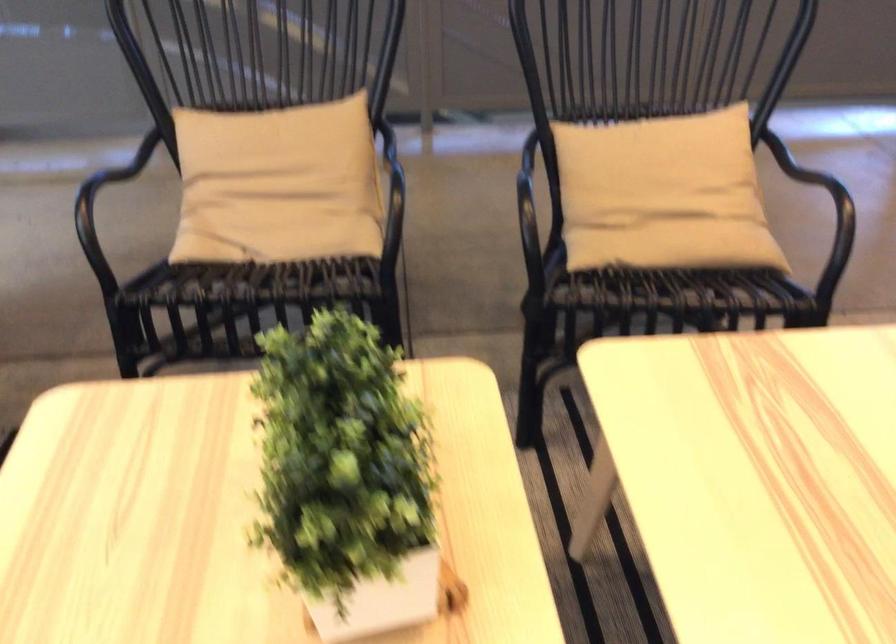
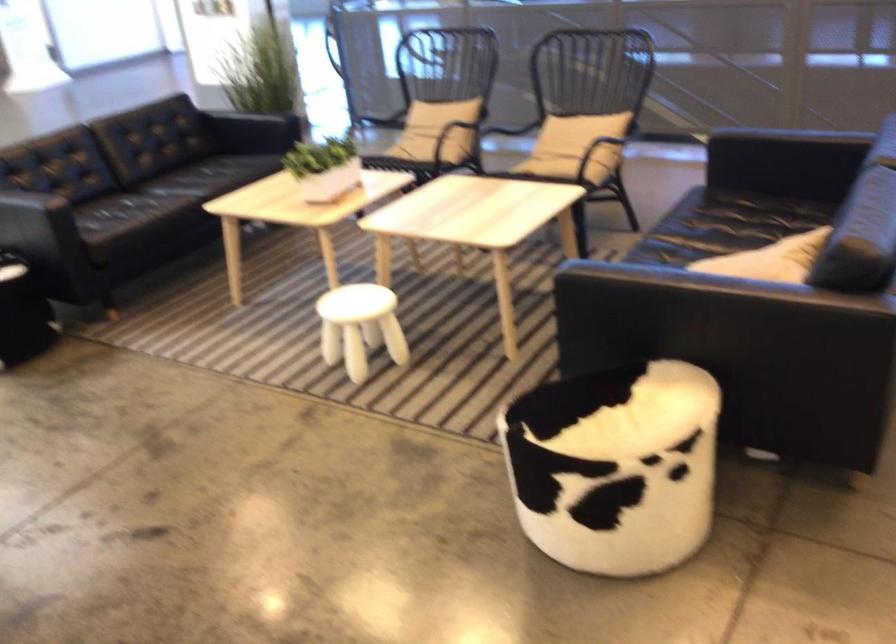
Find the pixel in the second image that matches point 418,491 in the first image.

(323, 167)